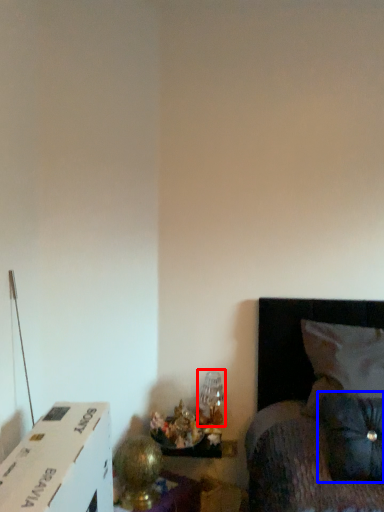
Question: Which of the following is the farthest to the observer, table lamp (highlighted by a red box) or pillow (highlighted by a blue box)?

Choices:
 (A) table lamp
 (B) pillow

Answer: (A)